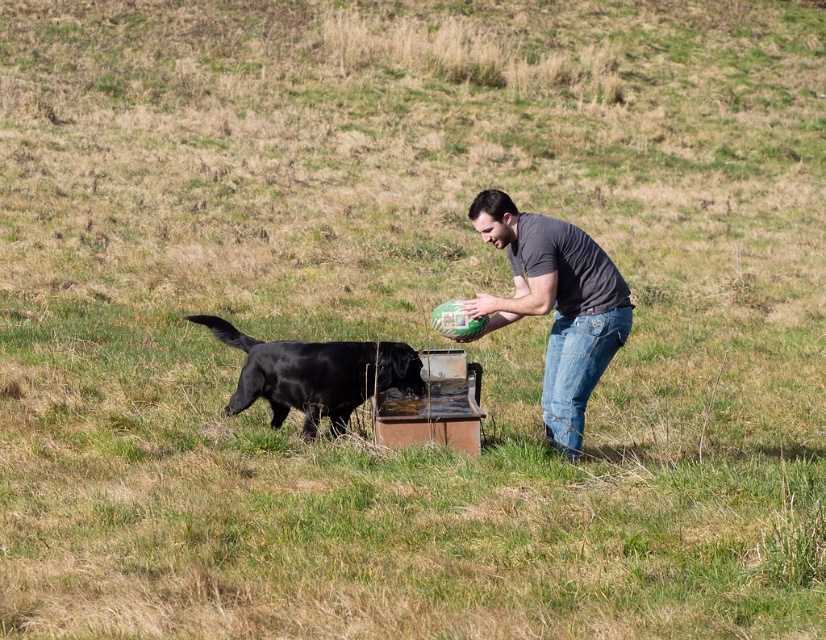
You are a photographer trying to capture the man and the dog in the scene. The gray matte shirt at center is at point [556,305]. Is the gray matte shirt at center closer to the black Labrador Retriever drinking water or to the man holding the rugby ball?

The gray matte shirt at center is at point [556,305]. Since the man is holding the rugby ball to the right of the trough where the dog is drinking, the gray matte shirt at center is closer to the man holding the rugby ball.

You are a photographer trying to capture a photo of the gray matte shirt at center and the black glossy fur at left. Which object should you focus on first to ensure both are in sharp focus?

The gray matte shirt at center should be focused on first because it is closer to the viewer than the black glossy fur at left, ensuring that both will be in focus when using a camera with proper depth of field settings.